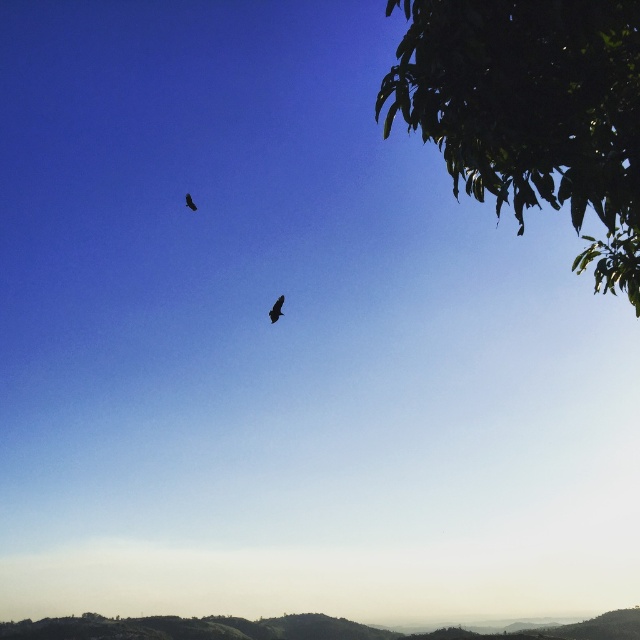
How distant is green leafy tree at upper right from dark brown feathered bird at upper center?

30.80 feet

Between green leafy tree at upper right and dark brown feathered bird at upper center, which one appears on the left side from the viewer's perspective?

From the viewer's perspective, dark brown feathered bird at upper center appears more on the left side.

Does point (545, 96) come farther from viewer compared to point (189, 209)?

That is False.

Identify the location of green leafy tree at upper right. (531, 109).

Find the location of a particular element. green leafy tree at upper right is located at coordinates (531, 109).

Is the position of green leafy tree at upper right more distant than that of dark brown feathers at center?

No, it is not.

Measure the distance between point (609,56) and camera.

15.31 feet

This screenshot has height=640, width=640. Identify the location of green leafy tree at upper right. (531, 109).

Between dark brown feathers at center and dark brown feathered bird at upper center, which one has less height?

dark brown feathers at center is shorter.

Which is more to the right, dark brown feathers at center or dark brown feathered bird at upper center?

dark brown feathers at center

Who is more distant from viewer, (278, 314) or (193, 202)?

Point (193, 202)

Where is `dark brown feathers at center`? This screenshot has width=640, height=640. dark brown feathers at center is located at coordinates (276, 308).